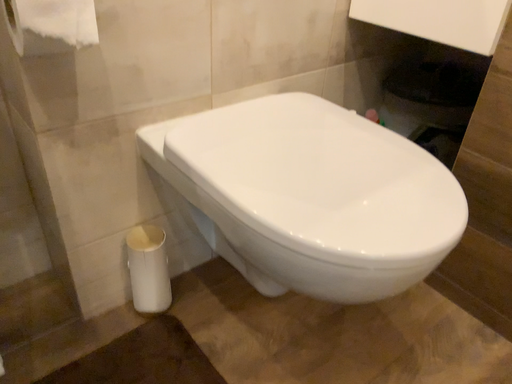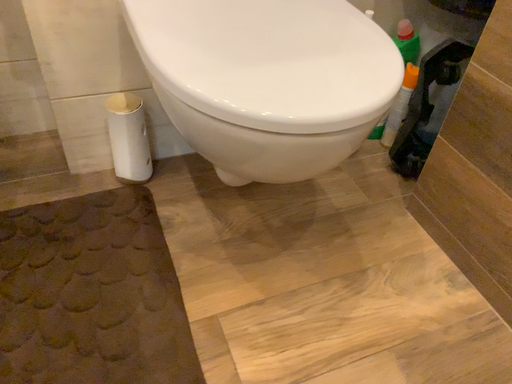
Question: How did the camera likely rotate when shooting the video?

Choices:
 (A) rotated right
 (B) rotated left

Answer: (B)